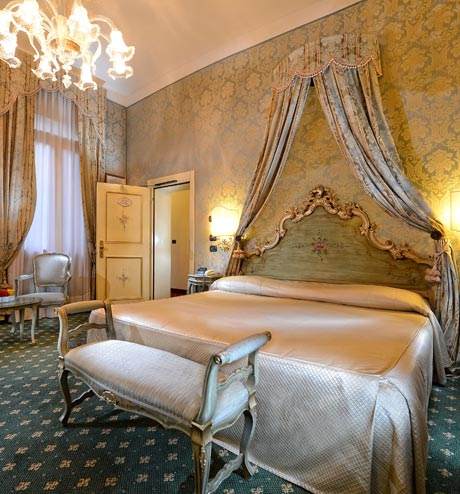
Where is `1 chair`? 1 chair is located at coordinates (47, 292).